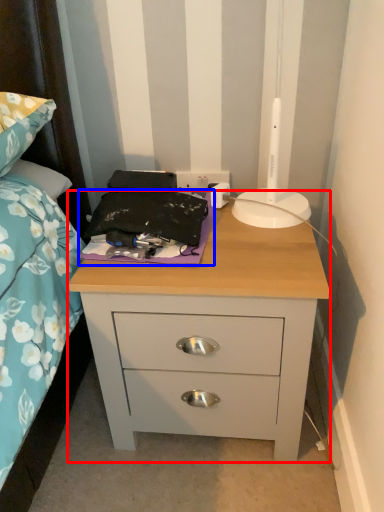
Question: Which object is further to the camera taking this photo, nightstand (highlighted by a red box) or sheet (highlighted by a blue box)?

Choices:
 (A) nightstand
 (B) sheet

Answer: (B)